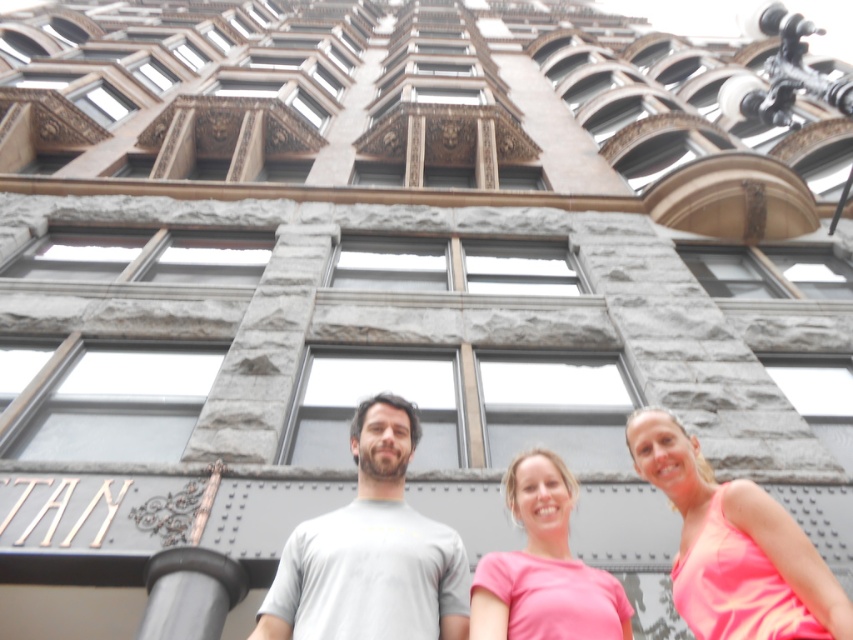
Question: Which object is farther from the camera taking this photo?

Choices:
 (A) pink fabric at center
 (B) pink matte shirt at center
 (C) black rubber pole at lower center
 (D) gray matte t-shirt at center

Answer: (C)

Question: Which point appears farthest from the camera in this image?

Choices:
 (A) (178, 556)
 (B) (665, 417)
 (C) (525, 564)
 (D) (399, 561)

Answer: (B)

Question: Is pink matte shirt at center wider than black rubber pole at lower center?

Choices:
 (A) no
 (B) yes

Answer: (B)

Question: Can you confirm if pink fabric at center is positioned below black rubber pole at lower center?

Choices:
 (A) yes
 (B) no

Answer: (B)

Question: Observing the image, what is the correct spatial positioning of pink fabric at center in reference to pink matte shirt at center?

Choices:
 (A) below
 (B) above

Answer: (B)

Question: Which is nearer to the pink fabric at center?

Choices:
 (A) black rubber pole at lower center
 (B) gray matte t-shirt at center
 (C) pink matte shirt at center

Answer: (C)